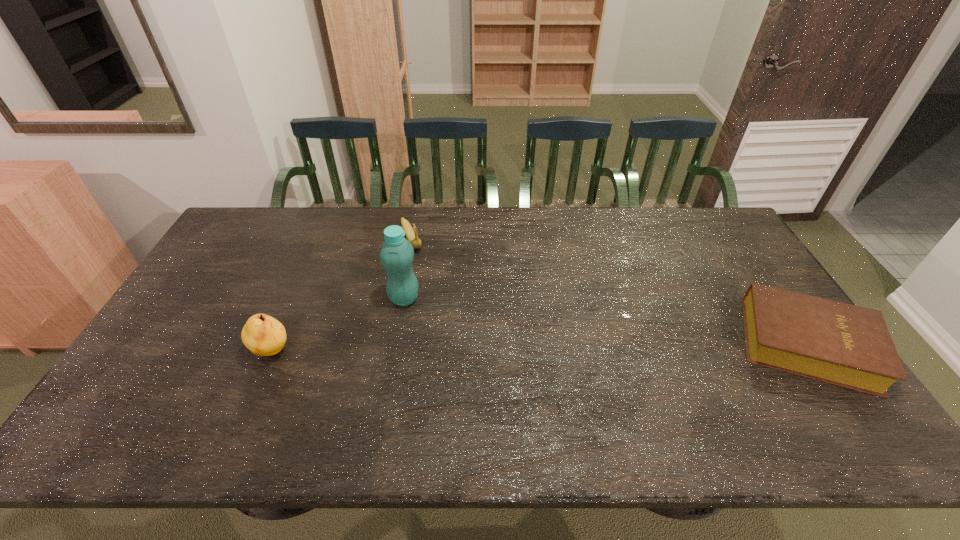
Locate an element on the screen. The image size is (960, 540). vacant space located 0.370m at the front cap of the water bottle is located at coordinates (521, 366).

Image resolution: width=960 pixels, height=540 pixels. I want to click on vacant space located at the front cap of the water bottle, so click(472, 338).

Locate an element on the screen. The width and height of the screenshot is (960, 540). vacant space situated at the stem of the farthest object is located at coordinates (423, 272).

Identify the location of vacant space located at the stem of the farthest object. The height and width of the screenshot is (540, 960). (432, 288).

What are the coordinates of `free region located at the stem of the farthest object` in the screenshot? It's located at (431, 286).

The image size is (960, 540). I want to click on object that is at the far edge, so click(x=412, y=237).

Locate an element on the screen. object located in the near edge section of the desktop is located at coordinates (842, 344).

In order to click on object present at the right edge in this screenshot , I will do `click(842, 344)`.

At what (x,y) coordinates should I click in order to perform the action: click on object located in the near right corner section of the desktop. Please return your answer as a coordinate pair (x, y). The width and height of the screenshot is (960, 540). Looking at the image, I should click on (842, 344).

Locate an element on the screen. Image resolution: width=960 pixels, height=540 pixels. vacant region at the far edge of the desktop is located at coordinates (552, 214).